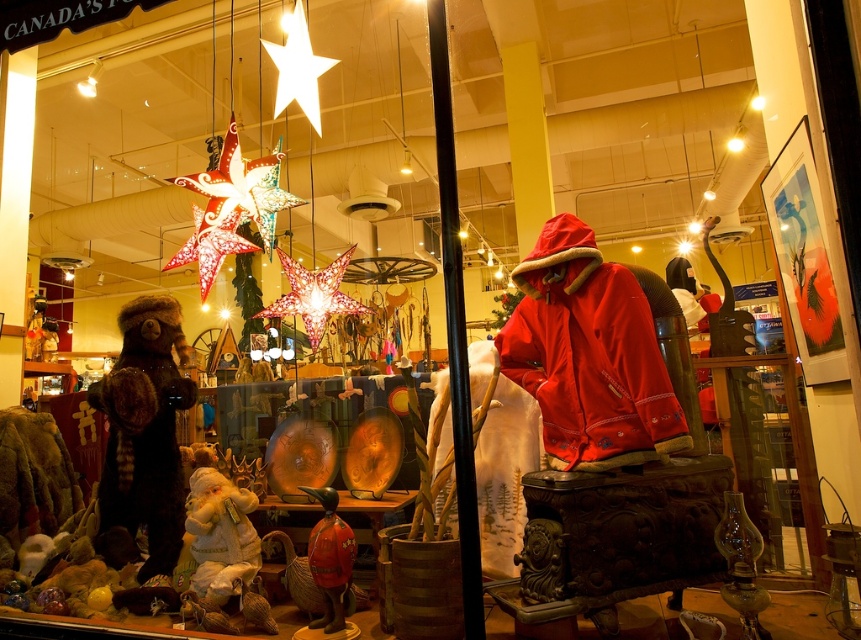
You are a delivery person who needs to place a new camera in the store. The camera must be placed within 3 meters of the fuzzy brown bear at left. Where can you place the camera to comply with this requirement?

The camera can be placed up to 3.04 meters away from the fuzzy brown bear at left, so placing it within that distance would meet the requirement.

You are a customer in the store looking to buy a gift for a friend. You see the red fleece jacket at center and the fuzzy brown bear at left. Which item is larger?

The fuzzy brown bear at left is larger than the red fleece jacket at center.

You are a customer in the store and want to place the red fleece jacket at center on top of the fuzzy brown bear at left. Is this possible based on their sizes?

The red fleece jacket at center is shorter than the fuzzy brown bear at left, so placing it on top should be possible since it is smaller in height.